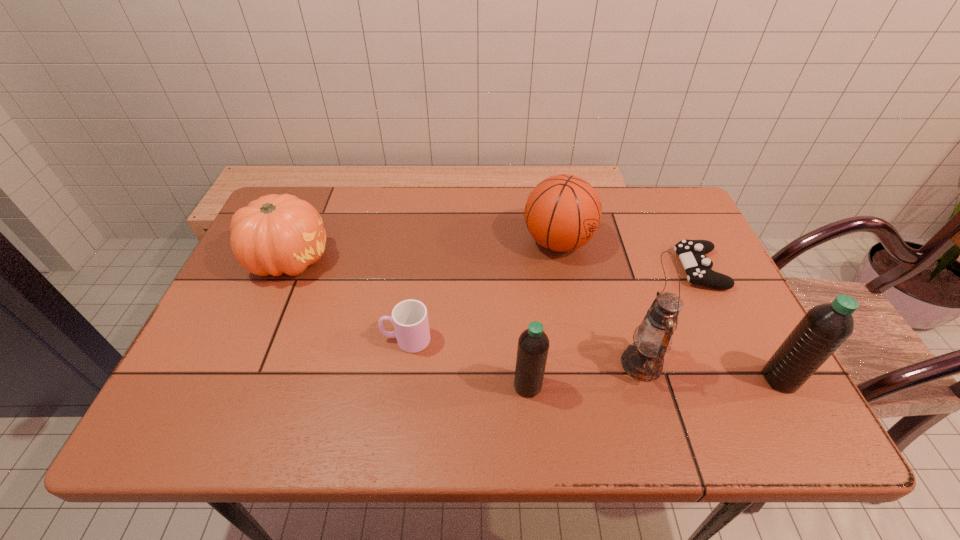
Image resolution: width=960 pixels, height=540 pixels. What are the coordinates of `the left water bottle` in the screenshot? It's located at (533, 344).

In order to click on the second tallest object in this screenshot , I will do `click(824, 328)`.

Find the location of a particular element. the taller water bottle is located at coordinates (824, 328).

Identify the location of basketball. (563, 212).

This screenshot has width=960, height=540. Identify the location of the sixth tallest object. (410, 319).

At what (x,y) coordinates should I click in order to perform the action: click on cup. Please return your answer as a coordinate pair (x, y). Looking at the image, I should click on (410, 319).

Identify the location of the shortest object. (692, 253).

This screenshot has height=540, width=960. I want to click on the leftmost object, so click(275, 234).

Find the location of a particular element. This screenshot has width=960, height=540. oil lamp is located at coordinates (643, 360).

This screenshot has width=960, height=540. Find the location of `vacant space located 0.180m on the left of the shorter water bottle`. vacant space located 0.180m on the left of the shorter water bottle is located at coordinates (428, 386).